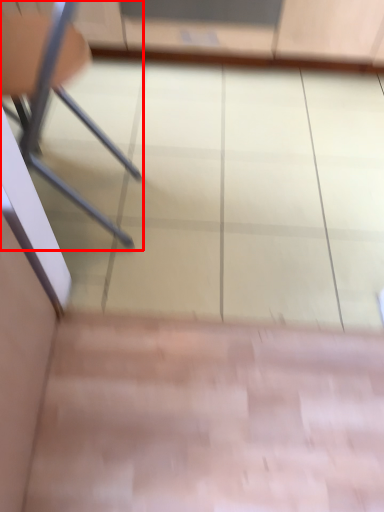
Question: From the image's perspective, considering the relative positions of chair (annotated by the red box) and screen door in the image provided, where is chair (annotated by the red box) located with respect to the staircase?

Choices:
 (A) above
 (B) below

Answer: (B)